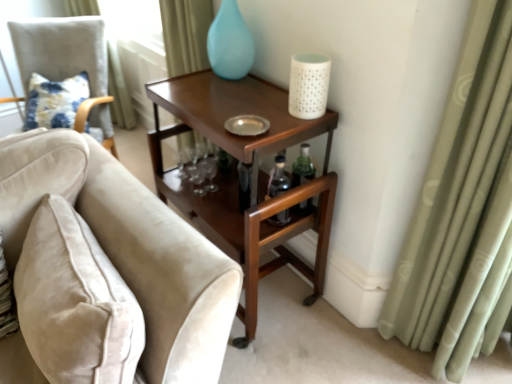
Question: Is velvet beige sofa at left, marked as the 1th chair in a right-to-left arrangement, completely or partially outside of matte blue glass vase at upper center?

Choices:
 (A) yes
 (B) no

Answer: (A)

Question: From the image's perspective, is velvet beige sofa at left, acting as the first chair starting from the front, beneath matte blue glass vase at upper center?

Choices:
 (A) no
 (B) yes

Answer: (B)

Question: From a real-world perspective, is velvet beige sofa at left, acting as the first chair starting from the front, on top of matte blue glass vase at upper center?

Choices:
 (A) yes
 (B) no

Answer: (B)

Question: Could you tell me if velvet beige sofa at left, arranged as the 2th chair when viewed from the back, is facing matte blue glass vase at upper center?

Choices:
 (A) yes
 (B) no

Answer: (B)

Question: Is velvet beige sofa at left, marked as the 1th chair in a right-to-left arrangement, turned away from matte blue glass vase at upper center?

Choices:
 (A) yes
 (B) no

Answer: (B)

Question: From a real-world perspective, is matte blue glass vase at upper center positioned above or below velvet beige sofa at left, which appears as the second chair when viewed from the left?

Choices:
 (A) below
 (B) above

Answer: (B)

Question: Based on their sizes in the image, would you say matte blue glass vase at upper center is bigger or smaller than velvet beige sofa at left, marked as the 1th chair in a right-to-left arrangement?

Choices:
 (A) big
 (B) small

Answer: (B)

Question: From the image's perspective, relative to velvet beige sofa at left, acting as the first chair starting from the front, is matte blue glass vase at upper center above or below?

Choices:
 (A) above
 (B) below

Answer: (A)

Question: Choose the correct answer: Is matte blue glass vase at upper center inside velvet beige sofa at left, arranged as the 2th chair when viewed from the back, or outside it?

Choices:
 (A) inside
 (B) outside

Answer: (B)

Question: Choose the correct answer: Is green fabric curtain at right, positioned as the 2th curtain in back-to-front order, inside velvet beige chair at left, acting as the second chair starting from the front, or outside it?

Choices:
 (A) inside
 (B) outside

Answer: (B)

Question: Based on their sizes in the image, would you say green fabric curtain at right, which appears as the first curtain when viewed from the right, is bigger or smaller than velvet beige chair at left, the 1th chair when ordered from left to right?

Choices:
 (A) small
 (B) big

Answer: (A)

Question: From the image's perspective, is green fabric curtain at right, which appears as the first curtain when viewed from the right, positioned above or below velvet beige chair at left, the 2th chair positioned from the right?

Choices:
 (A) below
 (B) above

Answer: (A)

Question: Considering the positions of green fabric curtain at right, the 2th curtain when ordered from left to right, and velvet beige chair at left, which is counted as the first chair, starting from the back, in the image, is green fabric curtain at right, the 2th curtain when ordered from left to right, wider or thinner than velvet beige chair at left, which is counted as the first chair, starting from the back,?

Choices:
 (A) thin
 (B) wide

Answer: (A)

Question: Is light green fabric curtain at upper left, which is counted as the 1th curtain, starting from the left, bigger or smaller than mahogany wood side table at upper right?

Choices:
 (A) small
 (B) big

Answer: (A)

Question: Relative to mahogany wood side table at upper right, is light green fabric curtain at upper left, arranged as the second curtain when viewed from the right, in front or behind?

Choices:
 (A) behind
 (B) front

Answer: (A)